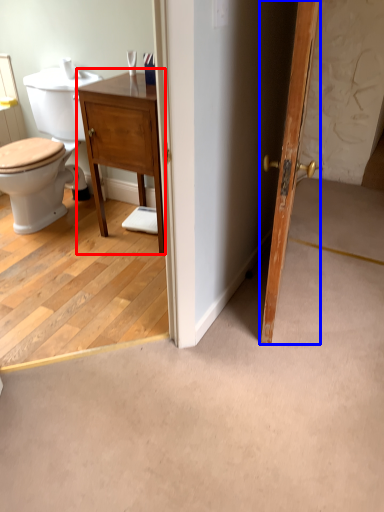
Question: Which of the following is the farthest to the observer, vanity (highlighted by a red box) or door (highlighted by a blue box)?

Choices:
 (A) vanity
 (B) door

Answer: (A)